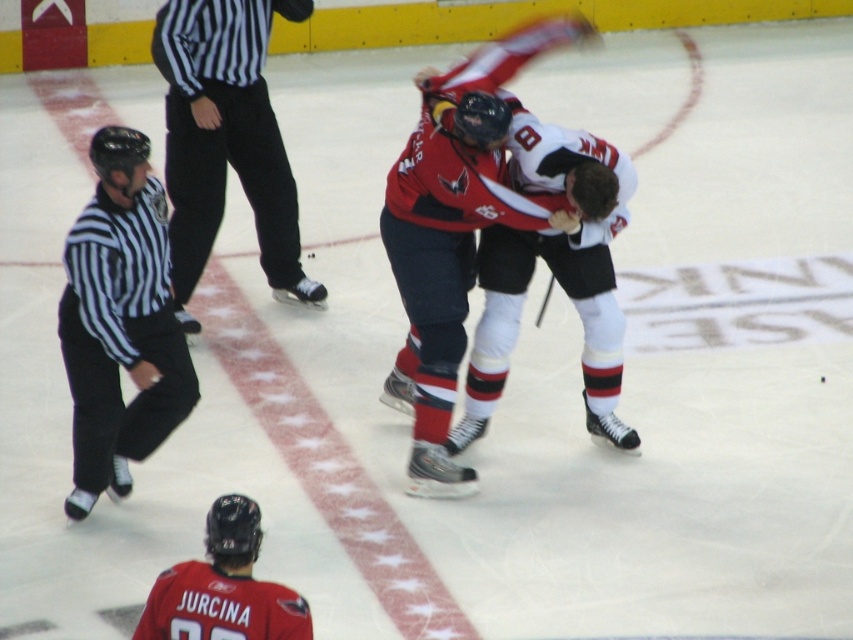
You are a spectator at the ice hockey game and want to take a photo of the red jersey at center and the red jersey hockey player at lower left. Which one should you zoom in on to capture more details?

The red jersey at center has a larger width than the red jersey hockey player at lower left, so you should zoom in on the red jersey at center to capture more details.

You are a spectator at the ice hockey game and want to take a photo of both the black striped shirt at upper left and the red jersey at center. Which one will appear larger in your photo?

The black striped shirt at upper left will appear larger in the photo because it is much taller than the red jersey at center.

You are a referee watching the ice hockey game. You notice a key point at point [553,273]. Which player is closest to that point?

The red jersey at center is located at point [553,273], so the player closest to that point is the red jersey at center.